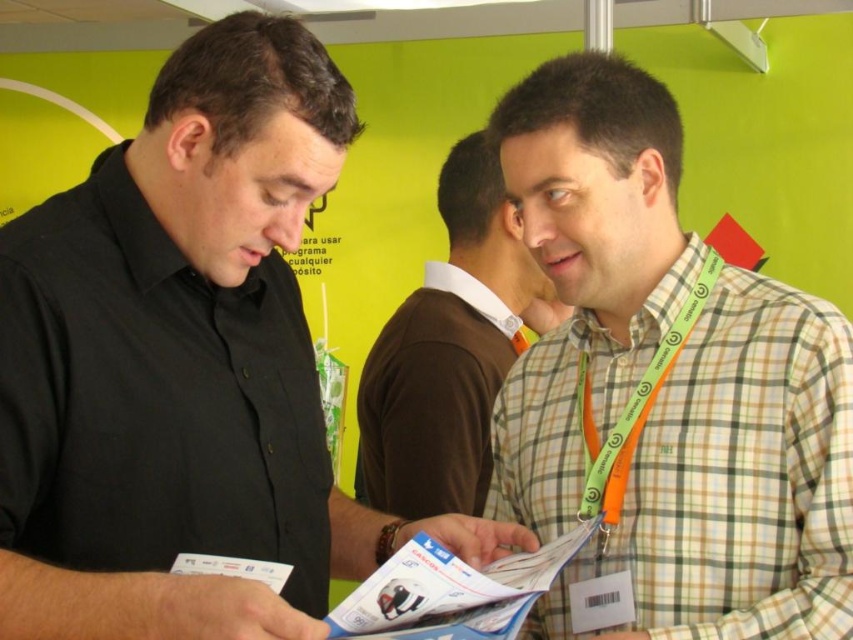
You are a photographer standing in the room and want to capture a photo of the green plaid shirt at center and orange fabric lanyard at right. The camera has a minimum focus distance of 3 inches. Can you take a photo of both objects without moving either?

The green plaid shirt at center is 3.74 inches from orange fabric lanyard at right. Since the distance between them is greater than the camera minimum focus distance of 3 inches, you can take a photo of both objects without moving either.

You are a photographer at the event and need to capture a group photo of the black shirt at left and the green plaid shirt at center. Which person should you ask to move closer to the camera to ensure both are in focus?

The green plaid shirt at center should move closer to the camera because the black shirt at left is bigger than the green plaid shirt at center, so adjusting the smaller one can help balance the framing.